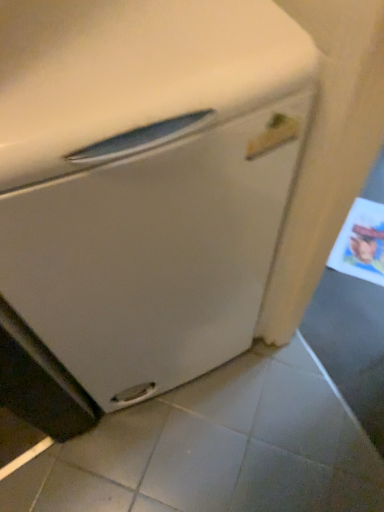
The width and height of the screenshot is (384, 512). In order to click on white matte refrigerator at center in this screenshot , I will do point(139,193).

What do you see at coordinates (139, 193) in the screenshot? I see `white matte refrigerator at center` at bounding box center [139, 193].

I want to click on white matte refrigerator at center, so click(139, 193).